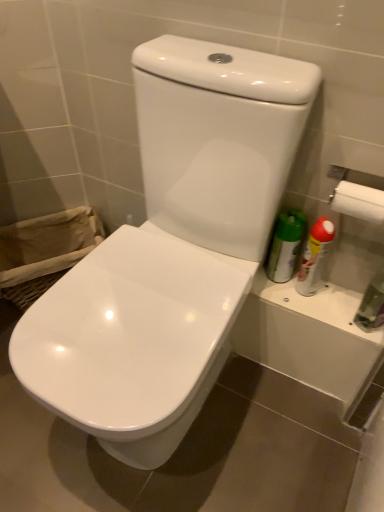
Question: Is burlap laundry basket at lower left wider or thinner than white glossy toilet at center, the first toilet from the right?

Choices:
 (A) thin
 (B) wide

Answer: (A)

Question: From the image's perspective, relative to white glossy toilet at center, the first toilet from the right, is burlap laundry basket at lower left above or below?

Choices:
 (A) above
 (B) below

Answer: (A)

Question: Based on their relative distances, which object is farther from the burlap laundry basket at lower left?

Choices:
 (A) white glossy toilet at center, the 2th toilet viewed from the right
 (B) white plastic spray can at right
 (C) white glossy toilet at center, placed as the second toilet when sorted from left to right
 (D) transparent plastic bottle at right

Answer: (D)

Question: Estimate the real-world distances between objects in this image. Which object is farther from the burlap laundry basket at lower left?

Choices:
 (A) white glossy toilet at center, placed as the second toilet when sorted from left to right
 (B) white glossy toilet at center, the 2th toilet viewed from the right
 (C) white plastic spray can at right
 (D) transparent plastic bottle at right

Answer: (D)